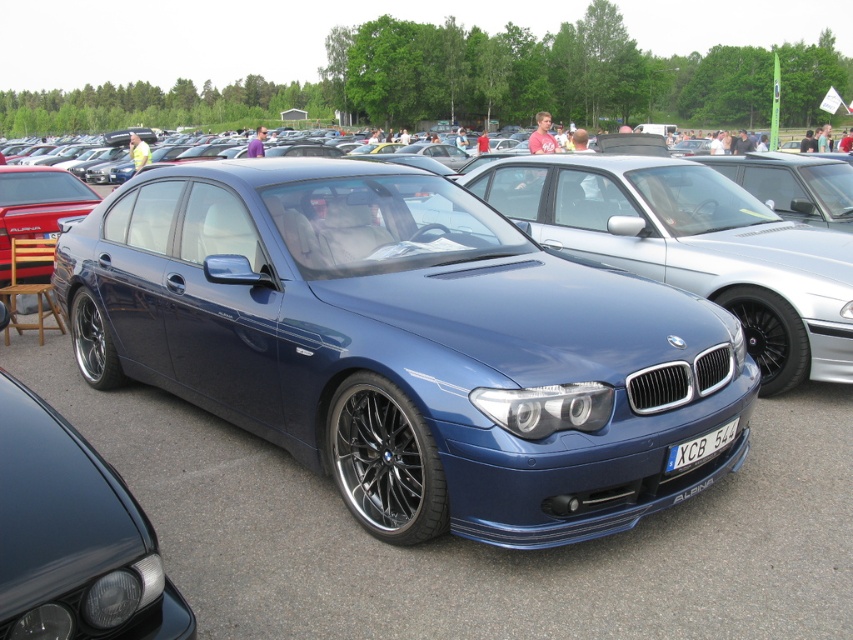
Question: Which of the following is the farthest from the observer?

Choices:
 (A) (732, 428)
 (B) (125, 248)
 (C) (633, 202)
 (D) (68, 186)

Answer: (D)

Question: Which is farther from the satin blue car at center?

Choices:
 (A) metallic blue sedan at center
 (B) white plastic license plate at center
 (C) shiny red sedan at left

Answer: (C)

Question: Is metallic blue sedan at center in front of white plastic license plate at center?

Choices:
 (A) no
 (B) yes

Answer: (B)

Question: Which object is closer to the camera taking this photo?

Choices:
 (A) white plastic license plate at center
 (B) satin blue car at center

Answer: (A)

Question: Is satin blue car at center to the right of shiny red sedan at left from the viewer's perspective?

Choices:
 (A) no
 (B) yes

Answer: (B)

Question: Does metallic blue sedan at center have a lesser width compared to shiny red sedan at left?

Choices:
 (A) no
 (B) yes

Answer: (A)